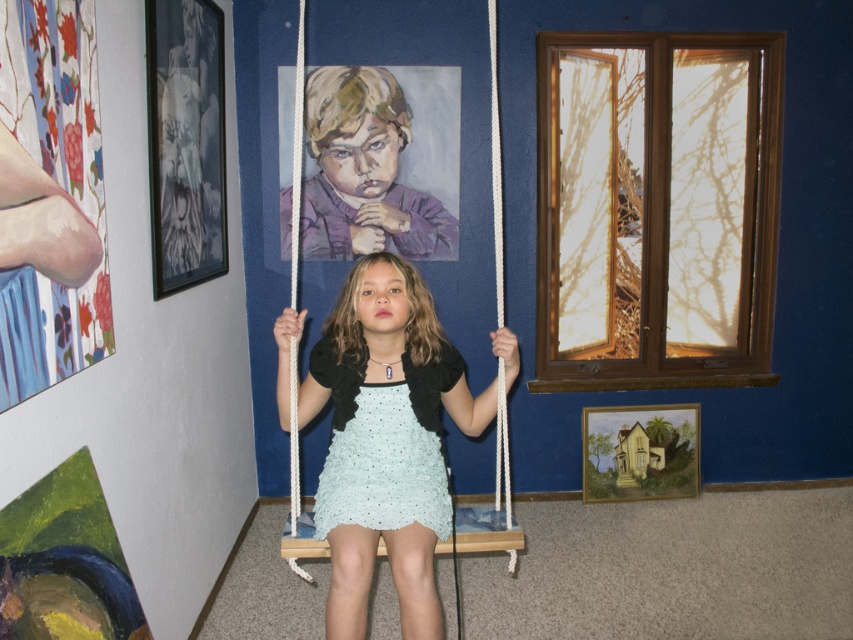
Question: Is light blue fabric dress at center positioned at the back of light blue crocheted dress at center?

Choices:
 (A) yes
 (B) no

Answer: (B)

Question: Where is light blue fabric dress at center located in relation to light blue crocheted dress at center in the image?

Choices:
 (A) below
 (B) above

Answer: (A)

Question: Which point is closer to the camera taking this photo?

Choices:
 (A) (361, 400)
 (B) (424, 321)

Answer: (A)

Question: Is light blue fabric dress at center closer to camera compared to light blue crocheted dress at center?

Choices:
 (A) no
 (B) yes

Answer: (B)

Question: Among these objects, which one is nearest to the camera?

Choices:
 (A) light blue crocheted dress at center
 (B) light blue fabric dress at center

Answer: (B)

Question: Which of the following is the farthest from the observer?

Choices:
 (A) light blue fabric dress at center
 (B) light blue crocheted dress at center

Answer: (B)